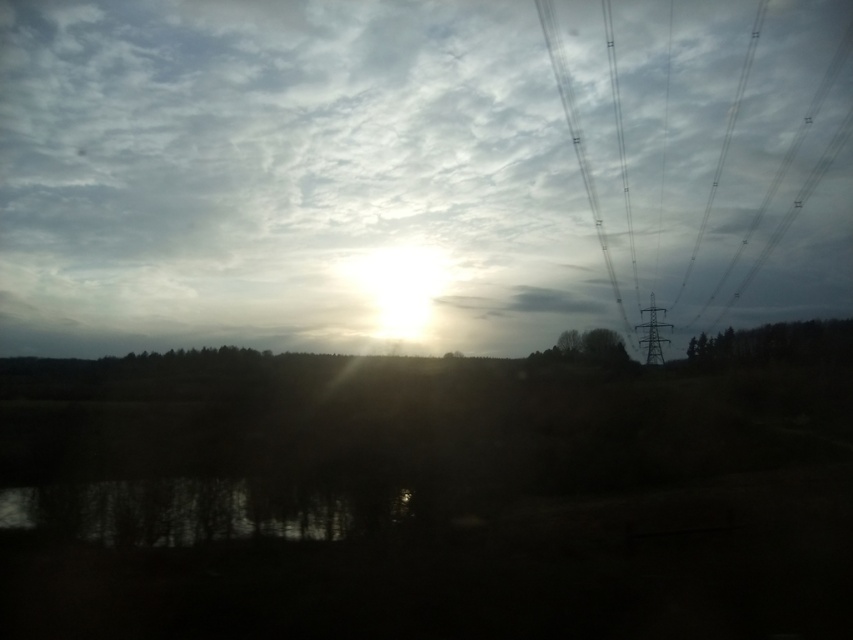
You are standing at the point marked as point (195, 509) in the bottom left of the image. You want to walk towards the sun in the scene. What will you see immediately in front of you?

Since point (195, 509) is on transparent glass water at bottom left, walking towards the sun would mean facing away from the water, so the transparent glass water at bottom left would be behind you. The immediate foreground in front would be the shoreline with trees silhouetted against the sky.

You are standing at the shoreline looking towards the water. There are two points marked in the image. Which point, point (387, 312) or point (755, 35), is closer to you?

Point (387, 312) is closer to the viewer than point (755, 35).